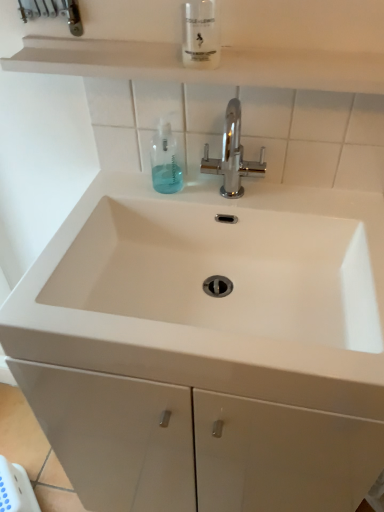
At what (x,y) coordinates should I click in order to perform the action: click on vacant region to the left of translucent plastic mouthwash at center, the first mouthwash ordered from the bottom. Please return your answer as a coordinate pair (x, y). Looking at the image, I should click on (120, 190).